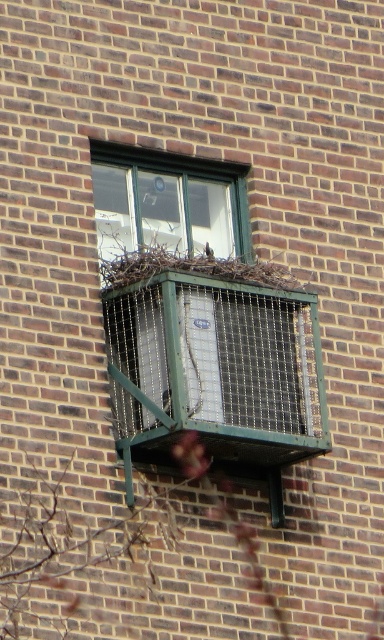
Is green mesh bird cage at center below green mesh air conditioner at center?

Yes, green mesh bird cage at center is below green mesh air conditioner at center.

Who is lower down, green mesh bird cage at center or green mesh air conditioner at center?

Positioned lower is green mesh bird cage at center.

Is point (253, 300) farther from camera compared to point (241, 164)?

No, (253, 300) is in front of (241, 164).

Where is `green mesh bird cage at center`? The width and height of the screenshot is (384, 640). green mesh bird cage at center is located at coordinates (215, 374).

The width and height of the screenshot is (384, 640). In order to click on brown textured twig at lower left in this screenshot , I will do `click(115, 545)`.

Who is shorter, brown textured twig at lower left or brown textured nest at center?

brown textured nest at center is shorter.

Is point (132, 556) in front of point (145, 252)?

Yes, it is in front of point (145, 252).

Locate an element on the screen. The image size is (384, 640). brown textured twig at lower left is located at coordinates (115, 545).

Can you confirm if green mesh bird cage at center is positioned below brown textured nest at center?

Yes.

Which is in front, point (271, 298) or point (107, 264)?

Point (271, 298) is more forward.

Identify the location of green mesh bird cage at center. (215, 374).